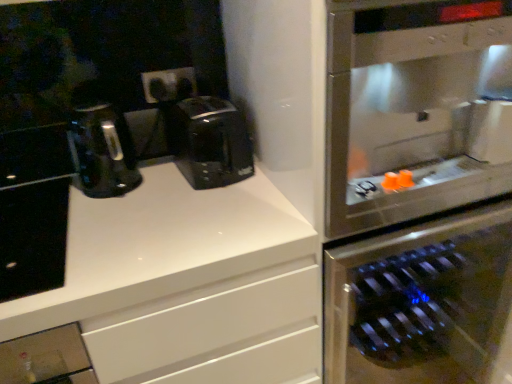
Identify the location of vacant area on top of black matte cabinet at left (from a real-world perspective). The height and width of the screenshot is (384, 512). (30, 229).